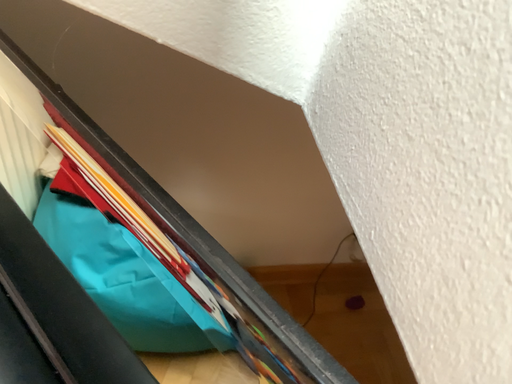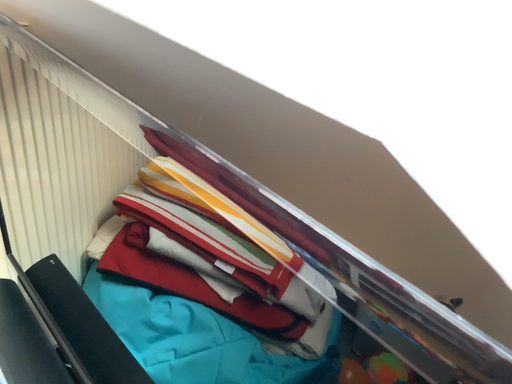
Question: Which way did the camera rotate in the video?

Choices:
 (A) rotated downward
 (B) rotated upward

Answer: (B)